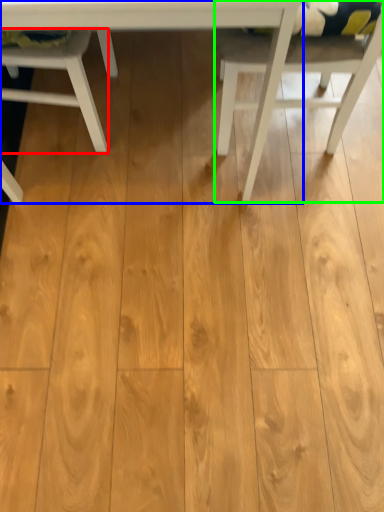
Question: Estimate the real-world distances between objects in this image. Which object is closer to chair (highlighted by a red box), table (highlighted by a blue box) or chair (highlighted by a green box)?

Choices:
 (A) table
 (B) chair

Answer: (A)